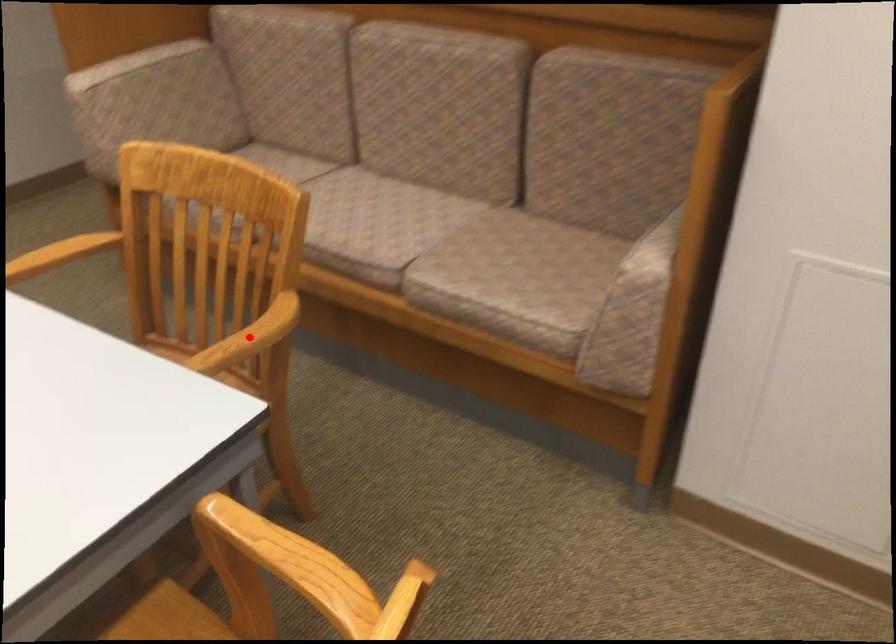
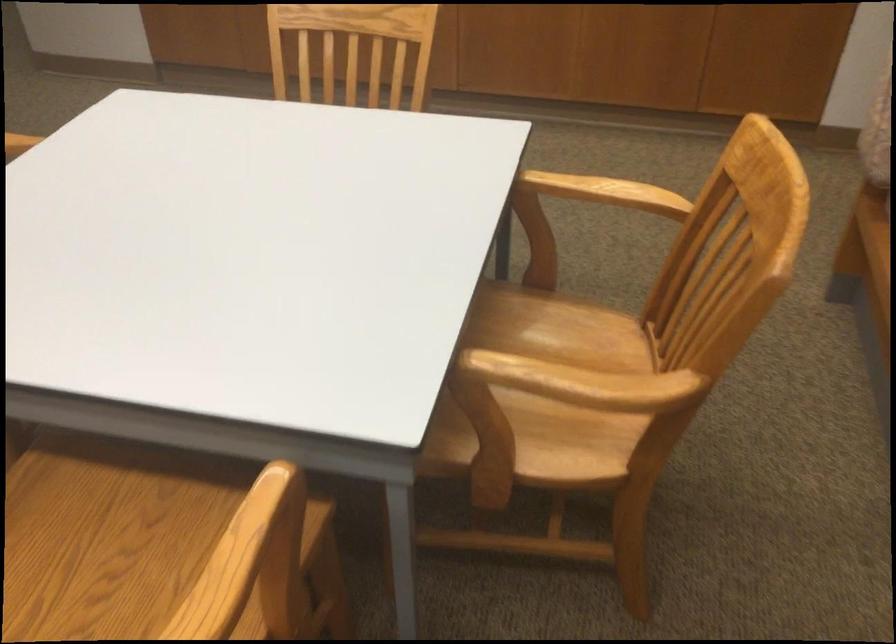
Question: A red point is marked in image1. In image2, is the corresponding 3D point closer to the camera or farther? Reply with the corresponding letter.

Choices:
 (A) The corresponding 3D point is closer.
 (B) The corresponding 3D point is farther.

Answer: (A)